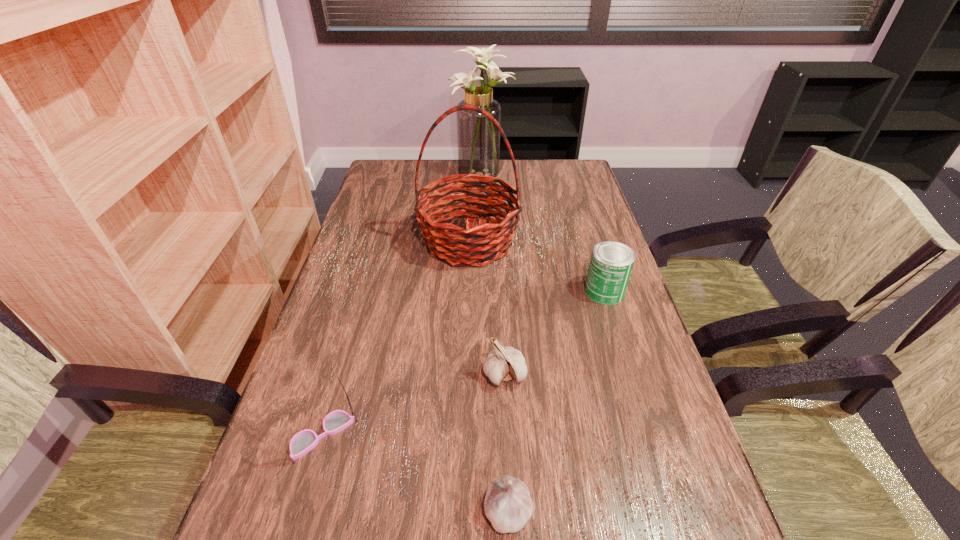
This screenshot has width=960, height=540. In order to click on blank area at the far right corner in this screenshot , I will do `click(584, 173)`.

What are the coordinates of `vacant area between the fourth nearest object and the third nearest object` in the screenshot? It's located at (555, 333).

Identify the location of free space between the fourth nearest object and the leftmost object. (464, 363).

Locate an element on the screen. This screenshot has width=960, height=540. vacant space in between the second nearest object and the third farthest object is located at coordinates [x=464, y=363].

The width and height of the screenshot is (960, 540). In order to click on free area in between the rightmost object and the second nearest object in this screenshot , I will do `click(464, 363)`.

Identify the location of unoccupied position between the fourth farthest object and the farthest object. This screenshot has width=960, height=540. (x=492, y=274).

This screenshot has width=960, height=540. What are the coordinates of `vacant space that's between the fourth farthest object and the second farthest object` in the screenshot? It's located at (487, 308).

You are a GUI agent. You are given a task and a screenshot of the screen. Output one action in this format:
    pyautogui.click(x=<x>, y=<y>)
    Task: Click on the unoccupied area between the rightmost object and the basket
    
    Given the screenshot: What is the action you would take?
    pyautogui.click(x=537, y=266)

Locate an element on the screen. The width and height of the screenshot is (960, 540). the closest object to the basket is located at coordinates (611, 264).

Select which object appears as the third closest to the third farthest object. Please provide its 2D coordinates. Your answer should be formatted as a tuple, i.e. [(x, y)], where the tuple contains the x and y coordinates of a point satisfying the conditions above.

[(507, 505)]